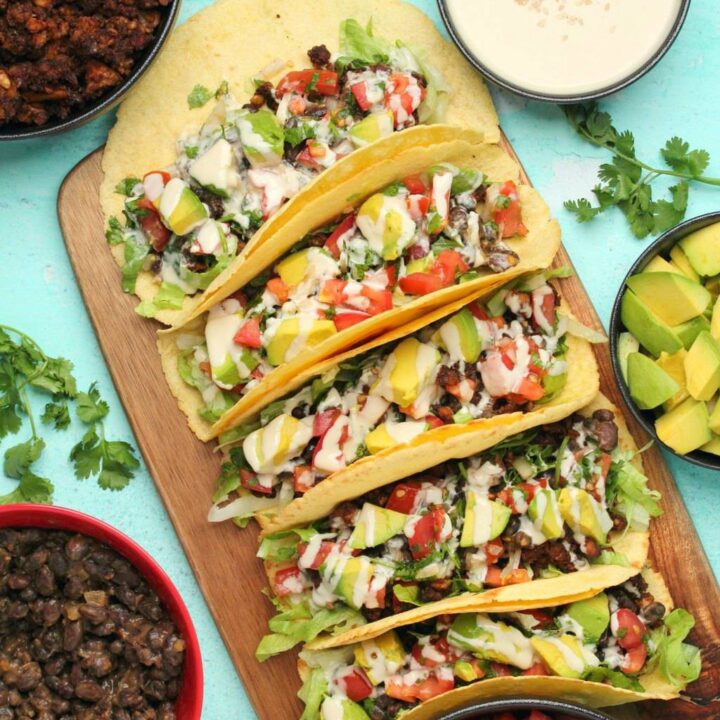
Find the location of `bowl of avacados`. bowl of avacados is located at coordinates coord(687,333).